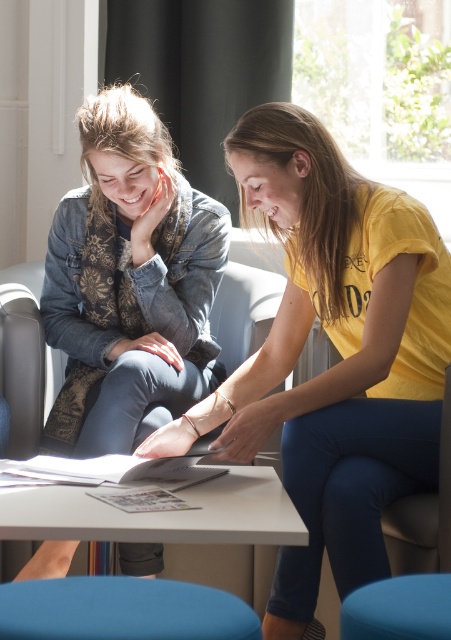
Who is more forward, (x=136, y=428) or (x=54, y=589)?

Point (x=54, y=589)

Who is shorter, denim jacket at upper left or blue fabric stool at lower center?

With less height is blue fabric stool at lower center.

The height and width of the screenshot is (640, 451). What are the coordinates of `denim jacket at upper left` in the screenshot? It's located at (129, 284).

Find the location of a particular element. Image resolution: width=451 pixels, height=640 pixels. denim jacket at upper left is located at coordinates (129, 284).

Which is more to the left, yellow matte t-shirt at center or denim jacket at upper left?

denim jacket at upper left is more to the left.

Who is higher up, yellow matte t-shirt at center or denim jacket at upper left?

denim jacket at upper left is above.

Between point (280, 372) and point (86, 349), which one is positioned in front?

Point (280, 372) is in front.

Identify the location of yellow matte t-shirt at center. Image resolution: width=451 pixels, height=640 pixels. (339, 352).

Between yellow matte t-shirt at center and blue fabric stool at lower center, which one has more height?

With more height is yellow matte t-shirt at center.

Based on the photo, does yellow matte t-shirt at center appear on the right side of blue fabric stool at lower center?

Yes, yellow matte t-shirt at center is to the right of blue fabric stool at lower center.

Locate an element on the screen. The height and width of the screenshot is (640, 451). yellow matte t-shirt at center is located at coordinates (339, 352).